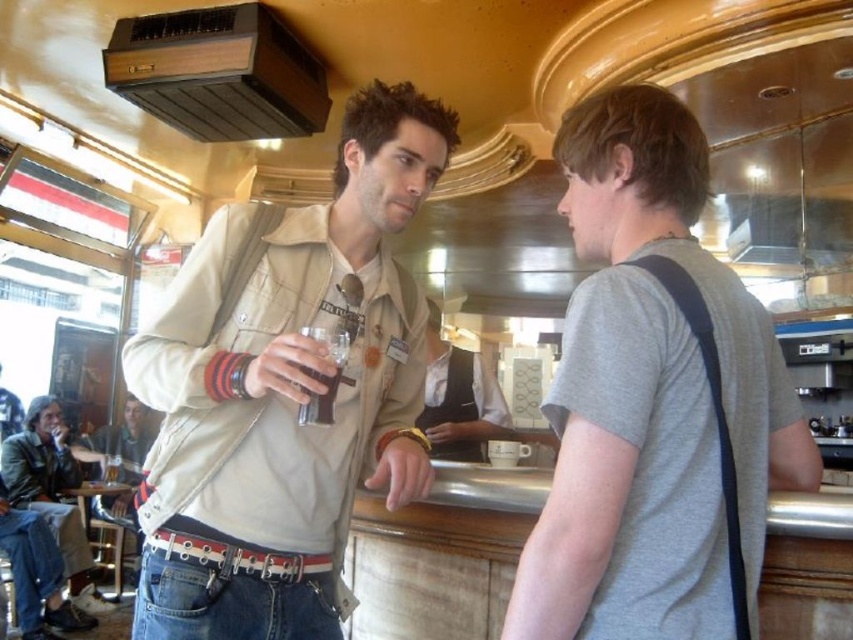
Question: Can you confirm if beige canvas jacket at center is bigger than gray matte t-shirt at center?

Choices:
 (A) no
 (B) yes

Answer: (B)

Question: Considering the real-world distances, which object is closest to the white uniform at center?

Choices:
 (A) dark brown liquid at center
 (B) leather jacket at lower left
 (C) beige canvas jacket at center
 (D) gray matte t-shirt at center

Answer: (C)

Question: Is gray matte t-shirt at center thinner than dark brown liquid at center?

Choices:
 (A) no
 (B) yes

Answer: (A)

Question: Which of these objects is positioned farthest from the leather jacket at lower left?

Choices:
 (A) dark brown liquid at center
 (B) white uniform at center
 (C) beige canvas jacket at center
 (D) gray matte t-shirt at center

Answer: (D)

Question: Which object is closer to the camera taking this photo?

Choices:
 (A) gray matte t-shirt at center
 (B) dark brown liquid at center
 (C) beige canvas jacket at center
 (D) white uniform at center

Answer: (A)

Question: Is gray matte t-shirt at center further to camera compared to dark brown liquid at center?

Choices:
 (A) no
 (B) yes

Answer: (A)